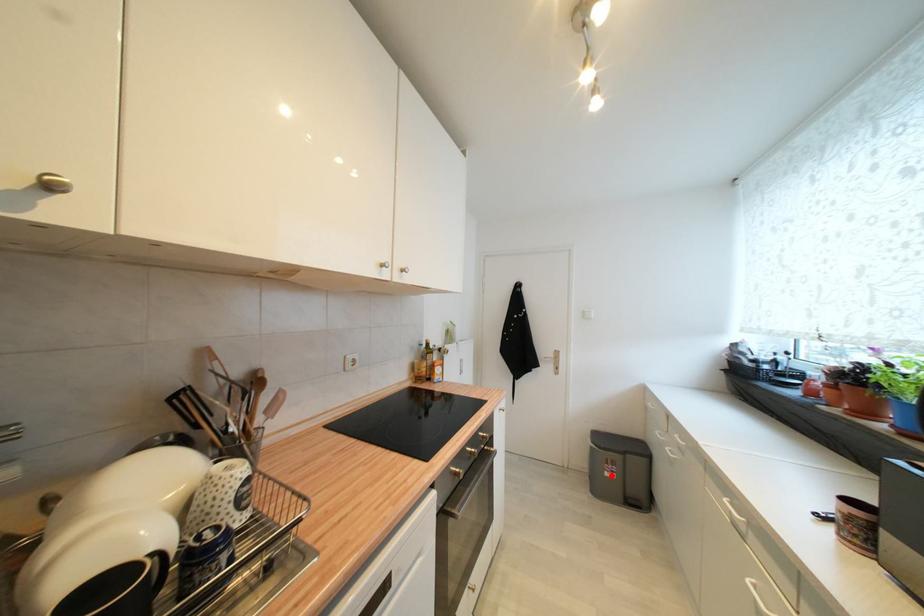
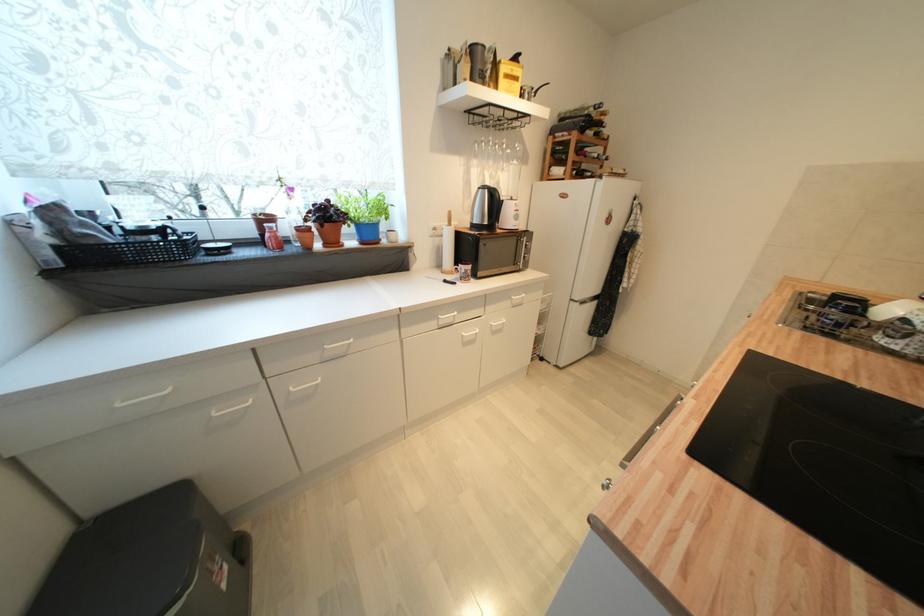
In the second image, find the point that corresponds to the highlighted location in the first image.

(228, 588)